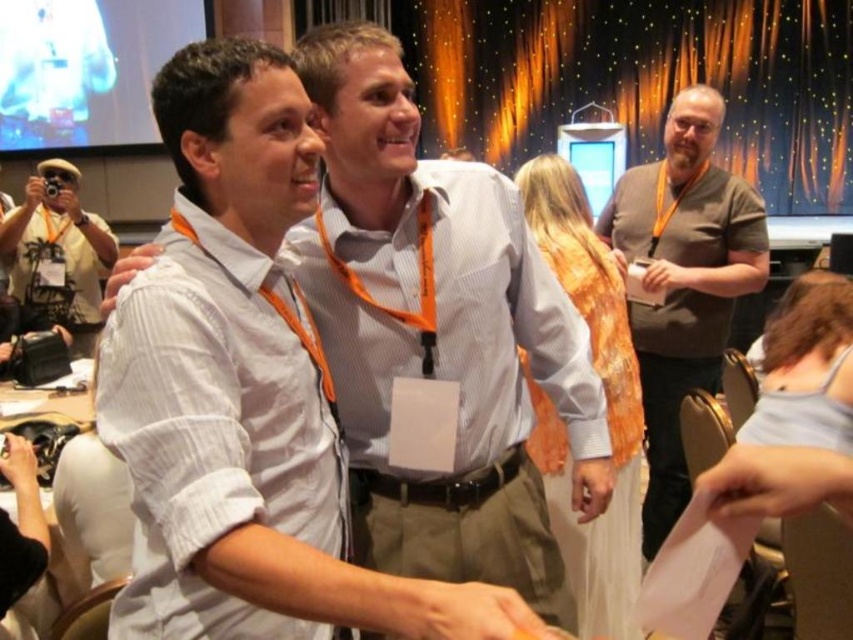
Question: Which point is farther to the camera?

Choices:
 (A) (111, 253)
 (B) (421, 180)
 (C) (665, 464)

Answer: (A)

Question: Estimate the real-world distances between objects in this image. Which object is farther from the matte black camera at left?

Choices:
 (A) white shirt at center
 (B) matte gray shirt at center

Answer: (A)

Question: Does white shirt at center have a greater width compared to matte black camera at left?

Choices:
 (A) yes
 (B) no

Answer: (B)

Question: Estimate the real-world distances between objects in this image. Which object is farther from the matte gray shirt at center?

Choices:
 (A) white shirt at center
 (B) matte black camera at left

Answer: (B)

Question: Is white shirt at center in front of matte gray shirt at center?

Choices:
 (A) no
 (B) yes

Answer: (B)

Question: Is matte gray shirt at center wider than matte black camera at left?

Choices:
 (A) no
 (B) yes

Answer: (A)